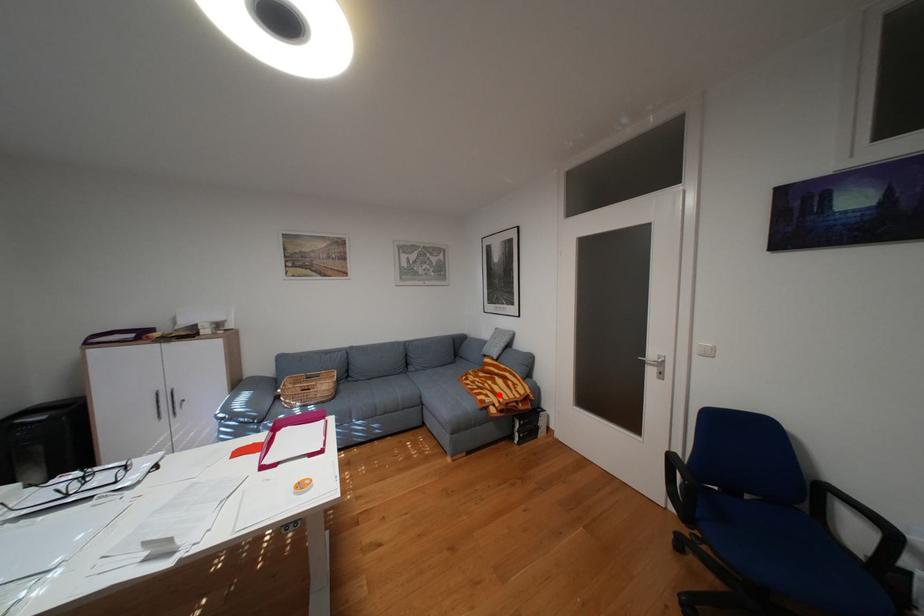
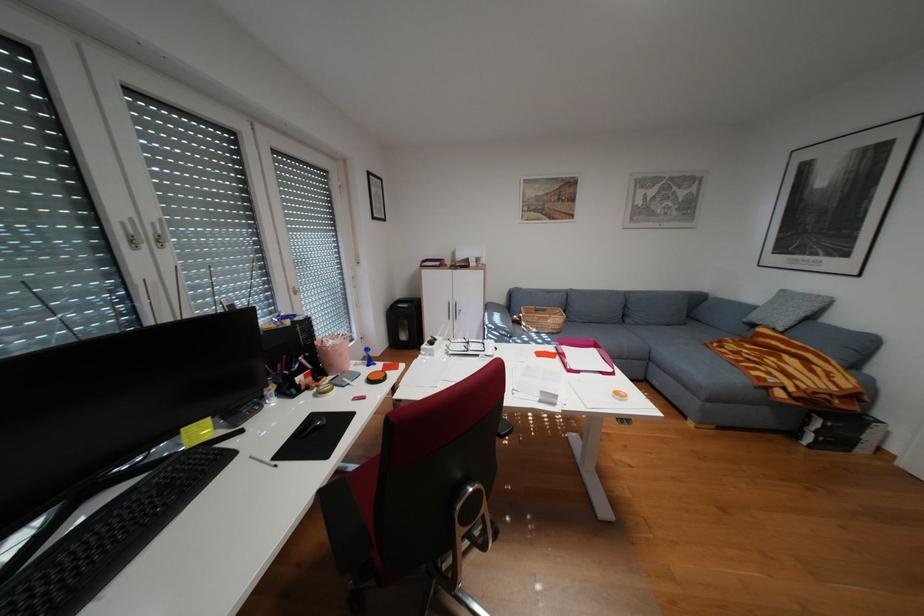
Find the pixel in the second image that matches the highlighted location in the first image.

(782, 373)